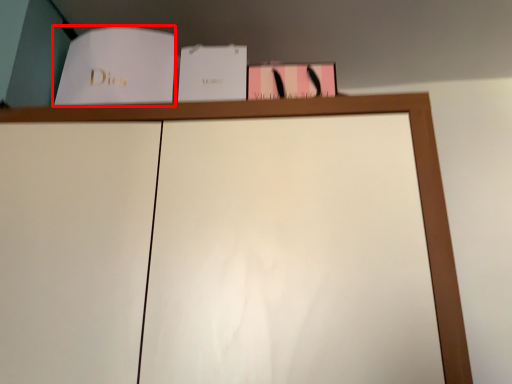
Question: From the image, what is the correct spatial relationship of paperback book (annotated by the red box) in relation to paperback book?

Choices:
 (A) right
 (B) left

Answer: (B)